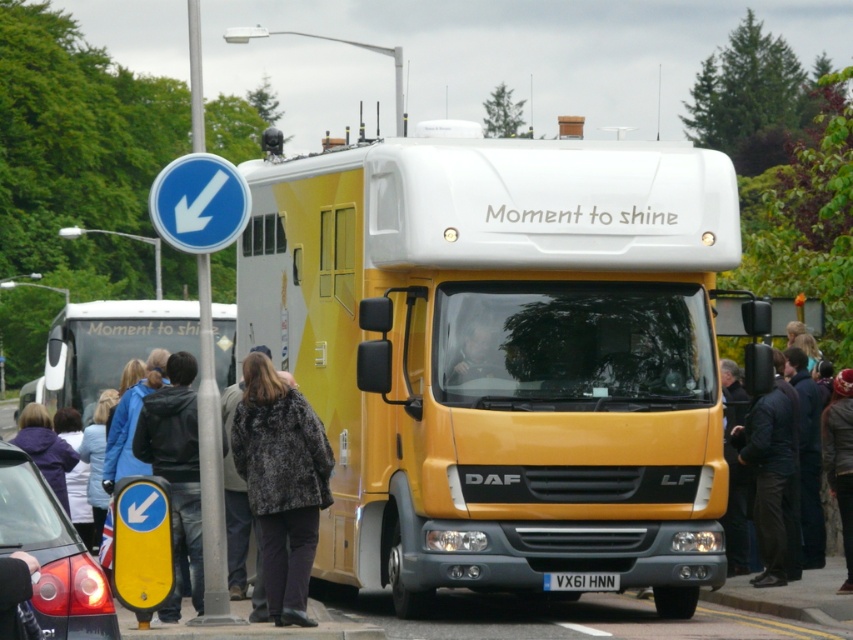
Question: Which is nearer to the black leather jacket at right?

Choices:
 (A) matte black car at lower left
 (B) dark gray knit hat at upper left
 (C) yellow matte bus at center
 (D) matte yellow truck at center

Answer: (B)

Question: Does matte yellow truck at center appear on the right side of black plastic license plate at center?

Choices:
 (A) no
 (B) yes

Answer: (A)

Question: Is dark gray knit hat at upper left to the left of black plastic license plate at center from the viewer's perspective?

Choices:
 (A) yes
 (B) no

Answer: (B)

Question: Is matte black car at lower left bigger than dark gray knit hat at upper left?

Choices:
 (A) no
 (B) yes

Answer: (A)

Question: Which point is closer to the camera taking this photo?

Choices:
 (A) (451, 321)
 (B) (834, 412)
 (C) (299, 241)

Answer: (A)

Question: Which of these objects is positioned farthest from the dark gray knit hat at upper left?

Choices:
 (A) black plastic license plate at center
 (B) black leather jacket at right

Answer: (A)